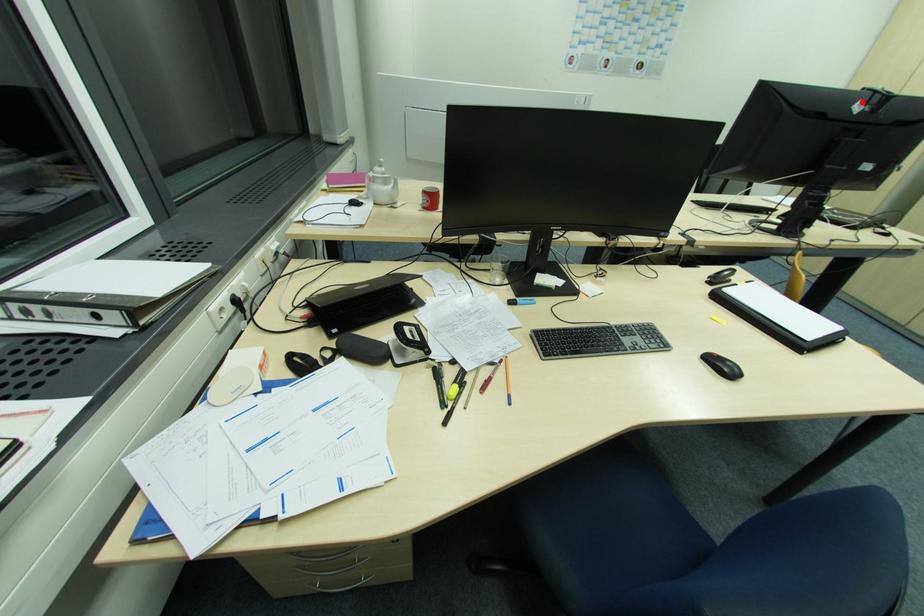
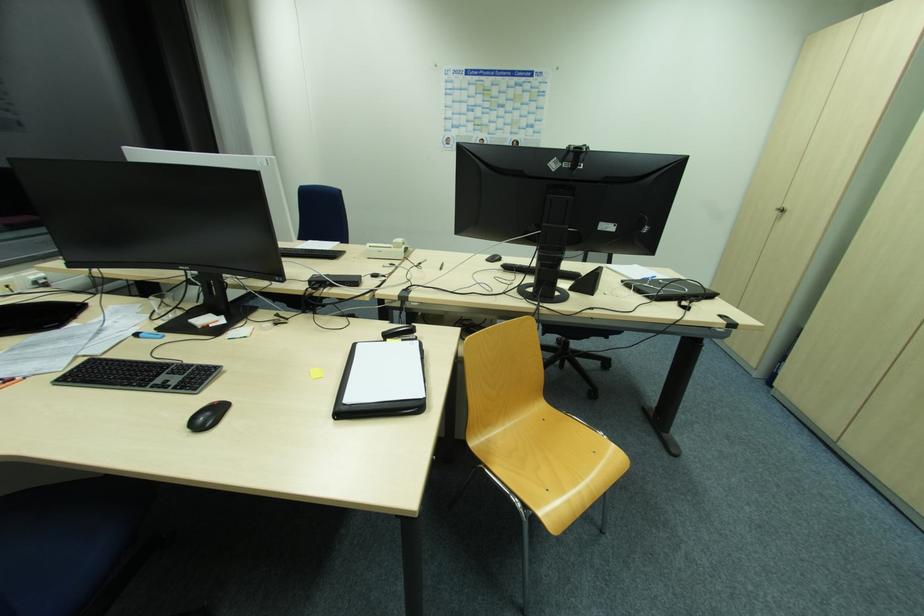
Where in the second image is the point corresponding to the highlighted location from the first image?

(557, 159)